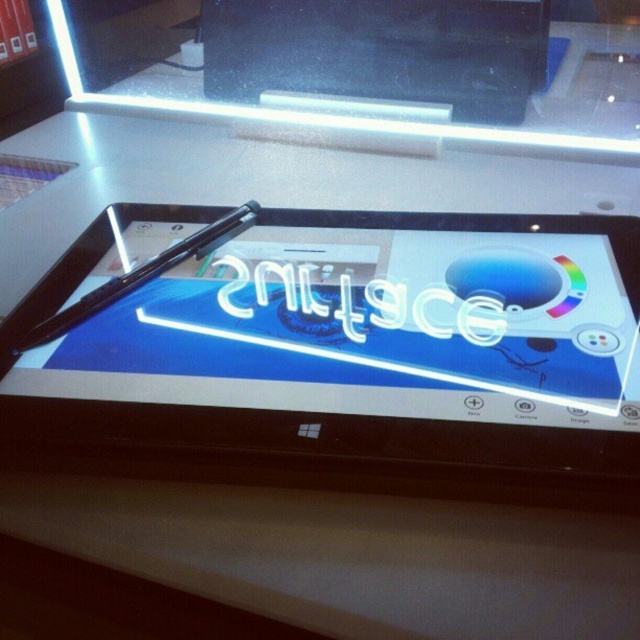
Is matte black tablet at center above black glossy pen at center?

Actually, matte black tablet at center is below black glossy pen at center.

Which is behind, point (579, 278) or point (244, 205)?

The point (244, 205) is more distant.

Is point (220, 385) farther from viewer compared to point (241, 225)?

No, it is not.

At what (x,y) coordinates should I click in order to perform the action: click on matte black tablet at center. Please return your answer as a coordinate pair (x, y). Looking at the image, I should click on (342, 356).

Which of these two, matte black laptop at upper center or black glossy pen at center, stands taller?

matte black laptop at upper center

Can you confirm if matte black laptop at upper center is bigger than black glossy pen at center?

Yes, matte black laptop at upper center is bigger than black glossy pen at center.

What do you see at coordinates (380, 51) in the screenshot? I see `matte black laptop at upper center` at bounding box center [380, 51].

The image size is (640, 640). I want to click on matte black laptop at upper center, so click(x=380, y=51).

Consider the image. Is matte black tablet at center further to the viewer compared to matte black laptop at upper center?

No, it is not.

What do you see at coordinates (342, 356) in the screenshot?
I see `matte black tablet at center` at bounding box center [342, 356].

The width and height of the screenshot is (640, 640). In order to click on matte black tablet at center in this screenshot , I will do `click(342, 356)`.